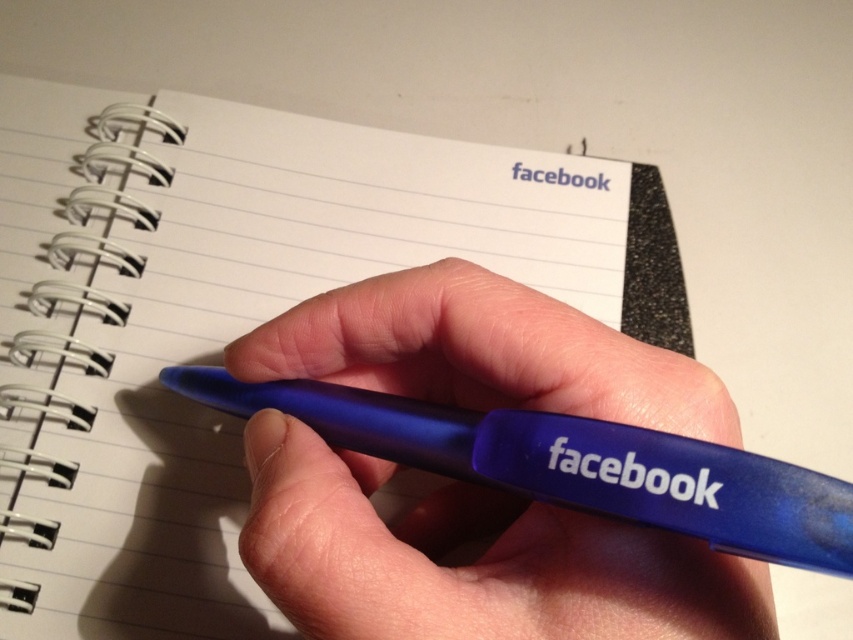
You are a student who needs to write a note on the white paper notebook at center. You have a blue pen with the word facebook printed on its barrel. If you place the pen diagonally across the frame so its tip touches the edge of the notebook, will the pen fit entirely on the notebook?

The pen and the white paper notebook at center are 21.02 inches apart. Since the pen is placed diagonally with its tip near the edge, the pen will extend beyond the notebook, so it won not fit entirely on the notebook.

You are trying to write in the notebook but need to know if the blue rubberized pen at center can fit horizontally across the width of the white paper notebook at center. Can it?

The white paper notebook at center might be wider than blue rubberized pen at center, so the pen can fit horizontally across the notebook.